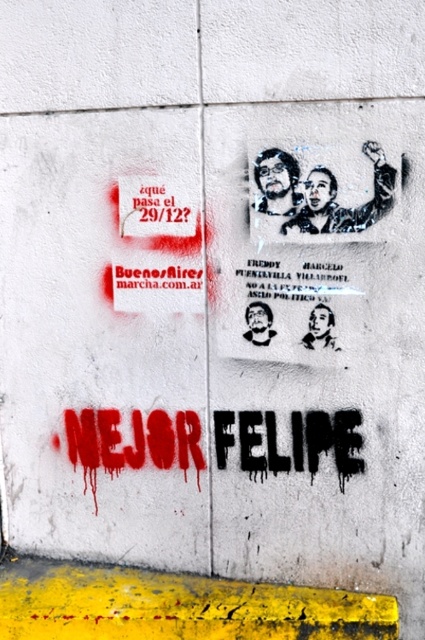
Is black stencil portrait at upper center further to camera compared to black glossy portrait at center?

No, black stencil portrait at upper center is in front of black glossy portrait at center.

Which is behind, point (354, 214) or point (308, 316)?

The point (308, 316) is more distant.

You are a GUI agent. You are given a task and a screenshot of the screen. Output one action in this format:
    pyautogui.click(x=<x>, y=<y>)
    Task: Click on the black stencil portrait at upper center
    The width and height of the screenshot is (425, 640).
    Given the screenshot: What is the action you would take?
    pyautogui.click(x=334, y=196)

Consider the image. Is yellow painted curb at lower center behind black glossy portrait at center?

No, it is not.

Is yellow painted curb at lower center wider than black glossy portrait at center?

Yes.

Which is in front, point (142, 636) or point (311, 336)?

Point (142, 636)

This screenshot has width=425, height=640. I want to click on yellow painted curb at lower center, so click(176, 605).

Is point (348, 209) closer to camera compared to point (277, 204)?

Yes.

Can you confirm if black stencil portrait at upper center is positioned above dark hair and beard at upper center?

No, black stencil portrait at upper center is not above dark hair and beard at upper center.

The height and width of the screenshot is (640, 425). Describe the element at coordinates (334, 196) in the screenshot. I see `black stencil portrait at upper center` at that location.

In order to click on black stencil portrait at upper center in this screenshot , I will do `click(334, 196)`.